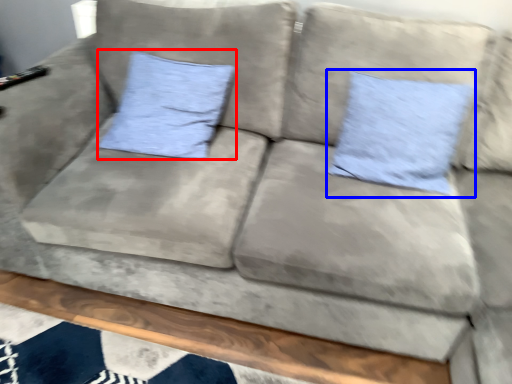
Question: Which of the following is the closest to the observer, pillow (highlighted by a red box) or pillow (highlighted by a blue box)?

Choices:
 (A) pillow
 (B) pillow

Answer: (B)